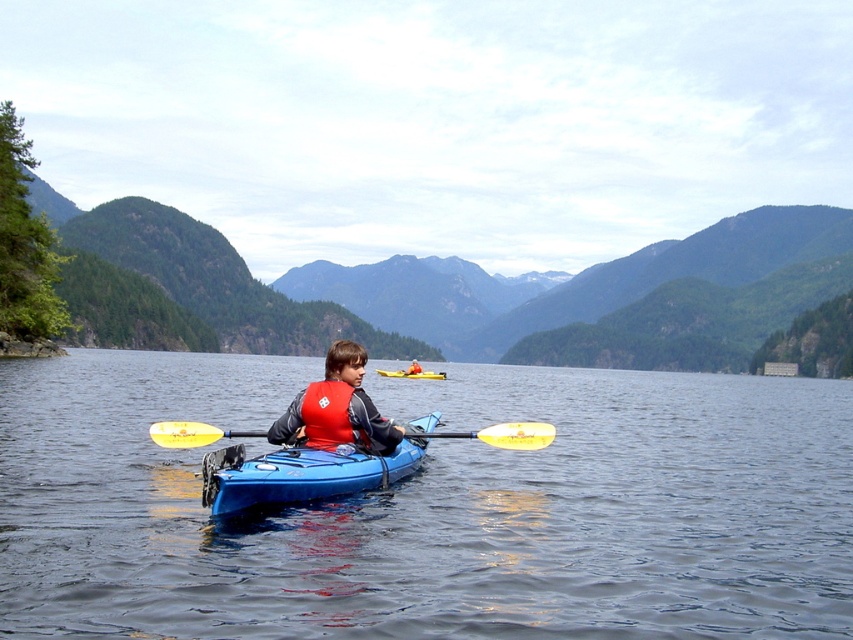
You are standing on the shore and see the blue plastic kayak at center. If you want to throw a lifebuoy to the kayak, will it reach the kayak? The lifebuoy has a maximum throwing distance of 8 meters.

The blue plastic kayak at center is 8.97 meters away from viewer. Since the lifebuoy can only reach up to 8 meters, it won not reach the kayak.

You are a safety inspector checking the kayaking equipment. You notice the blue plastic kayak at center and the orange matte life jacket at center. According to safety regulations, the life jacket must be easily accessible and not stored under any part of the kayak. Is the current arrangement compliant with safety standards?

The blue plastic kayak at center is positioned under orange matte life jacket at center, which means the life jacket is stored under the kayak. This violates safety regulations because the life jacket must be easily accessible and not stored under any part of the kayak.

You are a safety inspector checking the safety distance between the blue plastic kayak at center and the yellow foam paddle at center. The minimum safety distance required is 3 meters. Is the current distance compliant with the safety regulations?

The blue plastic kayak at center and yellow foam paddle at center are 2.90 meters apart from each other, which is less than the required 3 meters. Therefore, the current distance does not comply with the safety regulations.